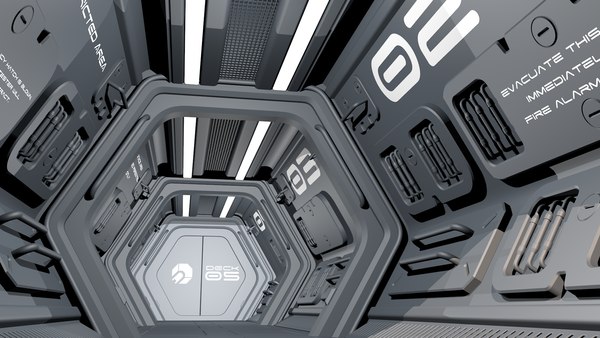
You are a GUI agent. You are given a task and a screenshot of the screen. Output one action in this format:
    pyautogui.click(x=<x>, y=<y>)
    Task: Click on the door
    
    Given the screenshot: What is the action you would take?
    pyautogui.click(x=202, y=257)